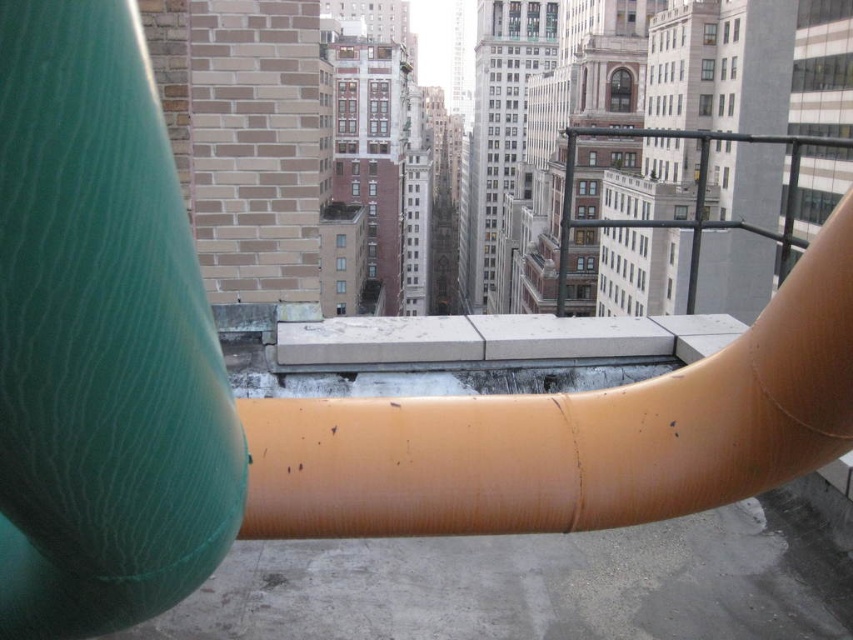
You are a city planner inspecting the rooftop. You need to replace the green rubber water pipe at left and the orange rubber pipe at center. Which pipe requires a larger replacement part?

The orange rubber pipe at center requires a larger replacement part because it is bigger than the green rubber water pipe at left.

You are a city planner reviewing this rooftop layout. The green rubber water pipe at left and the black metal rail at upper right are both in the foreground. Which object takes up more physical space in the image?

The black metal rail at upper right takes up more physical space in the image than the green rubber water pipe at left, as the green rubber water pipe at left occupies less space than black metal rail at upper right.